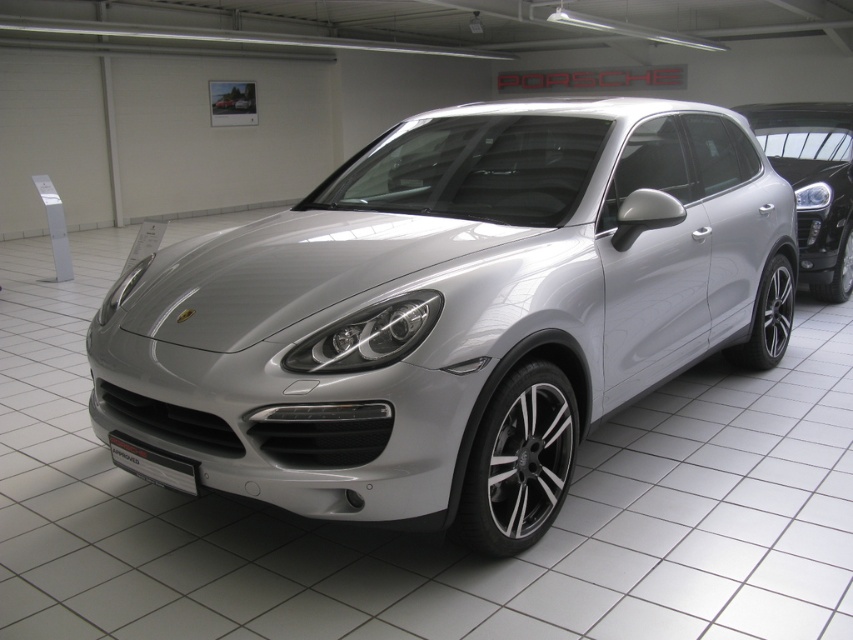
Between point (691, 200) and point (759, 104), which one is positioned behind?

Positioned behind is point (759, 104).

Can you confirm if silver metallic suv at center is thinner than satin silver suv at center?

No.

Between point (412, 134) and point (808, 161), which one is positioned in front?

Point (412, 134)

The height and width of the screenshot is (640, 853). Find the location of `silver metallic suv at center`. silver metallic suv at center is located at coordinates (450, 314).